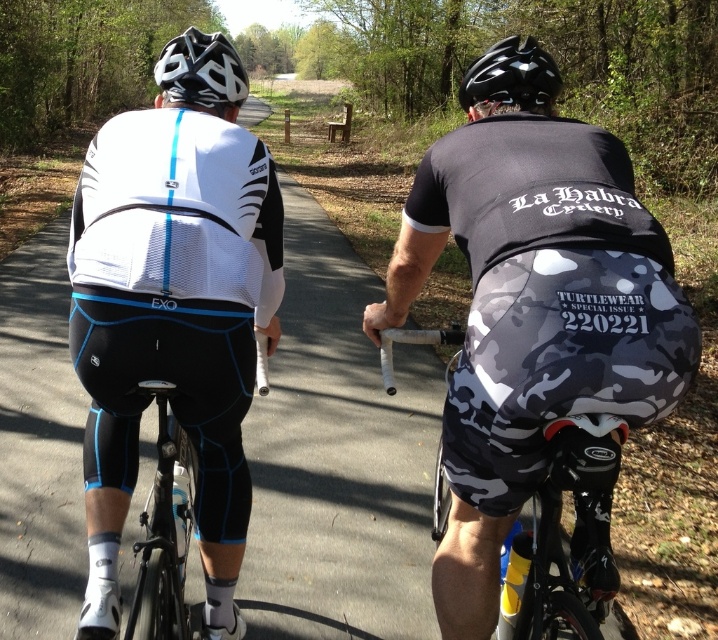
Question: In this image, where is camouflage fabric shorts at center located relative to matte black helmet at upper left?

Choices:
 (A) left
 (B) right

Answer: (B)

Question: Which is farther from the matte black helmet at upper center?

Choices:
 (A) matte black helmet at upper left
 (B) camouflage fabric bicycle at center

Answer: (A)

Question: Which is nearer to the matte black helmet at upper center?

Choices:
 (A) matte black helmet at upper left
 (B) camouflage fabric bicycle at center
 (C) camouflage fabric shorts at center
 (D) white matte cycling jersey at center

Answer: (C)

Question: Is camouflage fabric shorts at center thinner than white matte cycling jersey at center?

Choices:
 (A) no
 (B) yes

Answer: (B)

Question: Among these points, which one is nearest to the camera?

Choices:
 (A) (531, 518)
 (B) (228, 56)
 (C) (536, 72)

Answer: (C)

Question: Is white matte cycling jersey at center smaller than camouflage fabric bicycle at center?

Choices:
 (A) yes
 (B) no

Answer: (B)